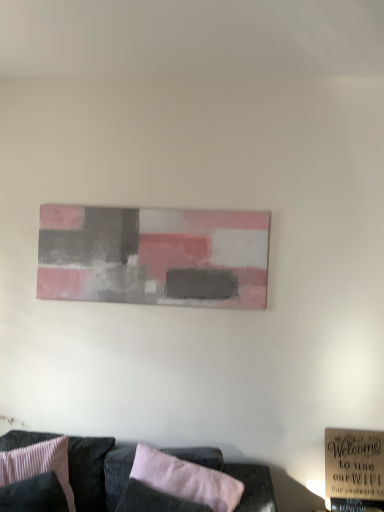
Question: Would you consider velvet black couch at lower center to be distant from pink ribbed fabric pillow at lower left, the 1th pillow when ordered from left to right?

Choices:
 (A) yes
 (B) no

Answer: (B)

Question: From the image's perspective, is velvet black couch at lower center over pink ribbed fabric pillow at lower left, the 1th pillow when ordered from left to right?

Choices:
 (A) yes
 (B) no

Answer: (B)

Question: Is velvet black couch at lower center oriented away from pink ribbed fabric pillow at lower left, the 1th pillow when ordered from left to right?

Choices:
 (A) no
 (B) yes

Answer: (B)

Question: Can you confirm if velvet black couch at lower center is positioned to the left of pink ribbed fabric pillow at lower left, which is counted as the second pillow, starting from the right?

Choices:
 (A) yes
 (B) no

Answer: (B)

Question: Is velvet black couch at lower center located outside pink ribbed fabric pillow at lower left, which is counted as the second pillow, starting from the right?

Choices:
 (A) no
 (B) yes

Answer: (B)

Question: Does velvet black couch at lower center lie behind pink ribbed fabric pillow at lower left, the 1th pillow when ordered from left to right?

Choices:
 (A) yes
 (B) no

Answer: (B)

Question: Can you confirm if pink fabric pillow at lower center, the 1th pillow viewed from the right, is positioned to the left of velvet black couch at lower center?

Choices:
 (A) yes
 (B) no

Answer: (B)

Question: From a real-world perspective, is pink fabric pillow at lower center, the second pillow positioned from the left, physically below velvet black couch at lower center?

Choices:
 (A) yes
 (B) no

Answer: (B)

Question: Is pink fabric pillow at lower center, the second pillow positioned from the left, bigger than velvet black couch at lower center?

Choices:
 (A) yes
 (B) no

Answer: (B)

Question: Is pink fabric pillow at lower center, the 1th pillow viewed from the right, to the right of velvet black couch at lower center from the viewer's perspective?

Choices:
 (A) no
 (B) yes

Answer: (B)

Question: Is velvet black couch at lower center at the back of pink fabric pillow at lower center, the 1th pillow viewed from the right?

Choices:
 (A) no
 (B) yes

Answer: (B)

Question: Does pink fabric pillow at lower center, the 1th pillow viewed from the right, have a greater width compared to velvet black couch at lower center?

Choices:
 (A) no
 (B) yes

Answer: (A)

Question: Does pink ribbed fabric pillow at lower left, the 1th pillow when ordered from left to right, have a lesser height compared to pink fabric pillow at lower center, the 1th pillow viewed from the right?

Choices:
 (A) no
 (B) yes

Answer: (A)